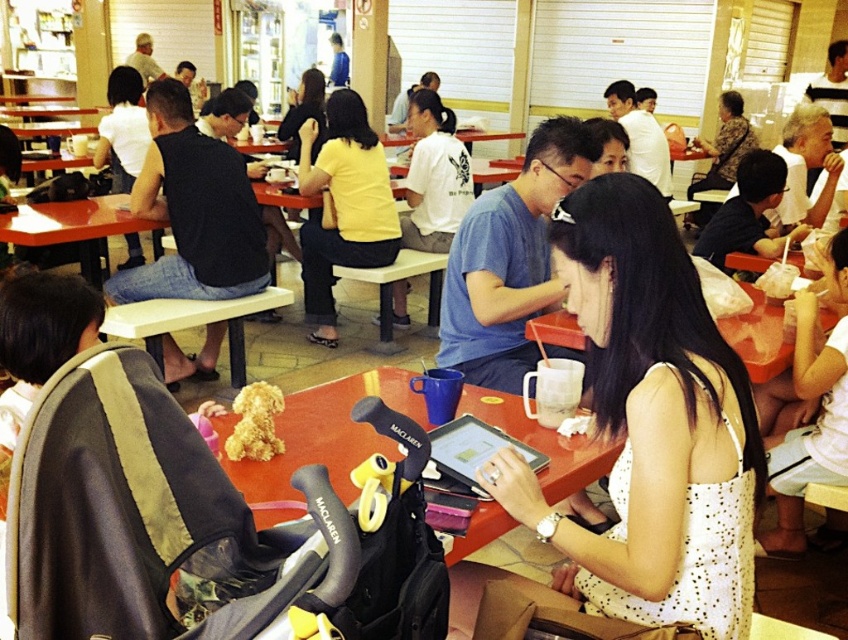
Between matte black shirt at upper right and fluffy golden dog at center, which one has less height?

fluffy golden dog at center

Which is below, matte black shirt at upper right or fluffy golden dog at center?

fluffy golden dog at center is below.

Image resolution: width=848 pixels, height=640 pixels. What are the coordinates of `matte black shirt at upper right` in the screenshot? It's located at (748, 212).

Between point (678, 266) and point (215, 186), which one is positioned behind?

Positioned behind is point (215, 186).

Who is higher up, white dotted dress at center or black sleeveless shirt at left?

black sleeveless shirt at left is above.

Is point (662, 296) positioned before point (197, 214)?

Yes, point (662, 296) is closer to viewer.

This screenshot has width=848, height=640. I want to click on white dotted dress at center, so click(x=650, y=426).

Who is lower down, blue cotton shirt at center or orange plastic table at center?

blue cotton shirt at center

Which is in front, point (476, 320) or point (103, 220)?

Point (476, 320) is in front.

Identify the location of blue cotton shirt at center. (509, 260).